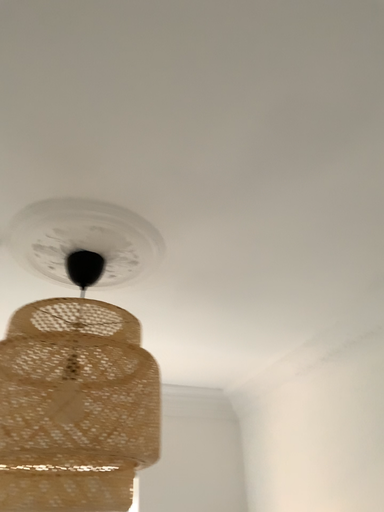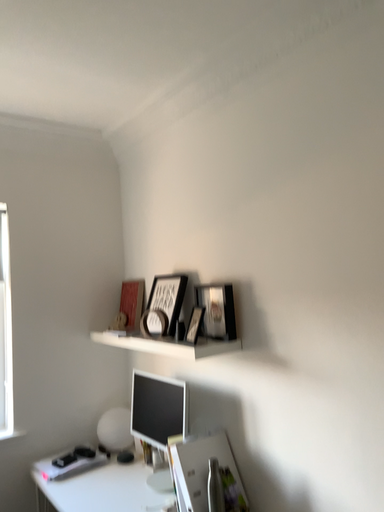
Question: How did the camera likely rotate when shooting the video?

Choices:
 (A) rotated right
 (B) rotated left

Answer: (A)